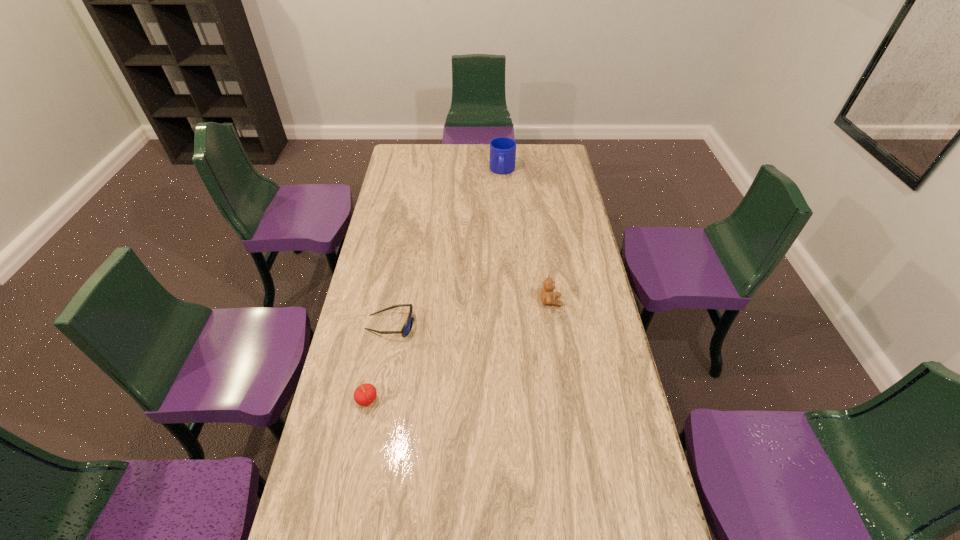
At what (x,y) coordinates should I click in order to perform the action: click on blank space at the far left corner of the desktop. Please return your answer as a coordinate pair (x, y). This screenshot has height=540, width=960. Looking at the image, I should click on (397, 157).

Identify the location of vacant space at the far right corner. The image size is (960, 540). (557, 146).

The image size is (960, 540). I want to click on free point between the teddy bear and the shortest object, so click(470, 313).

Identify the location of free spot between the nearest object and the teddy bear. This screenshot has height=540, width=960. pyautogui.click(x=459, y=350).

Image resolution: width=960 pixels, height=540 pixels. In order to click on vacant space in between the mug and the nearest object in this screenshot , I will do `click(435, 285)`.

Locate an element on the screen. This screenshot has width=960, height=540. unoccupied area between the teddy bear and the mug is located at coordinates (527, 236).

Where is `unoccupied area between the sunglasses and the cherry`? unoccupied area between the sunglasses and the cherry is located at coordinates (378, 362).

This screenshot has width=960, height=540. Find the location of `blank region between the sunglasses and the teddy bear`. blank region between the sunglasses and the teddy bear is located at coordinates (470, 313).

Identify the location of free space between the teddy bear and the sunglasses. (470, 313).

Find the location of `vacant point located between the rightmost object and the cherry`. vacant point located between the rightmost object and the cherry is located at coordinates (459, 350).